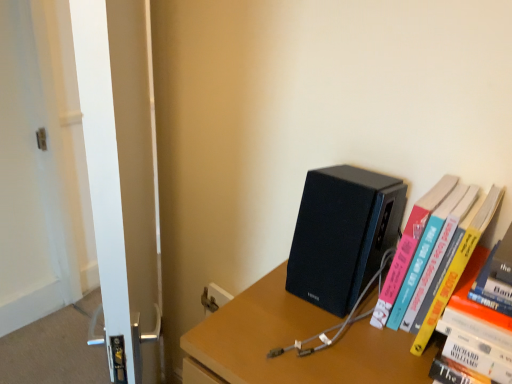
Question: Is black matte speaker at center-right far from matte black speaker at upper right?

Choices:
 (A) yes
 (B) no

Answer: (B)

Question: From a real-world perspective, is black matte speaker at center-right positioned over matte black speaker at upper right based on gravity?

Choices:
 (A) no
 (B) yes

Answer: (B)

Question: Is black matte speaker at center-right completely or partially outside of matte black speaker at upper right?

Choices:
 (A) no
 (B) yes

Answer: (B)

Question: Is black matte speaker at center-right behind matte black speaker at upper right?

Choices:
 (A) yes
 (B) no

Answer: (A)

Question: From the image's perspective, is black matte speaker at center-right on top of matte black speaker at upper right?

Choices:
 (A) yes
 (B) no

Answer: (A)

Question: Does black matte speaker at center-right turn towards matte black speaker at upper right?

Choices:
 (A) no
 (B) yes

Answer: (A)

Question: Is white glossy screen door at left oriented towards black matte speaker at center-right?

Choices:
 (A) yes
 (B) no

Answer: (B)

Question: Could black matte speaker at center-right be considered to be inside white glossy screen door at left?

Choices:
 (A) no
 (B) yes

Answer: (A)

Question: Is white glossy screen door at left shorter than black matte speaker at center-right?

Choices:
 (A) no
 (B) yes

Answer: (A)

Question: Is white glossy screen door at left taller than black matte speaker at center-right?

Choices:
 (A) yes
 (B) no

Answer: (A)

Question: Is white glossy screen door at left wider than black matte speaker at center-right?

Choices:
 (A) no
 (B) yes

Answer: (A)

Question: Is black matte speaker at center-right at the back of white glossy screen door at left?

Choices:
 (A) no
 (B) yes

Answer: (B)

Question: Is matte black speaker at upper right beside black matte speaker at center-right?

Choices:
 (A) no
 (B) yes

Answer: (A)